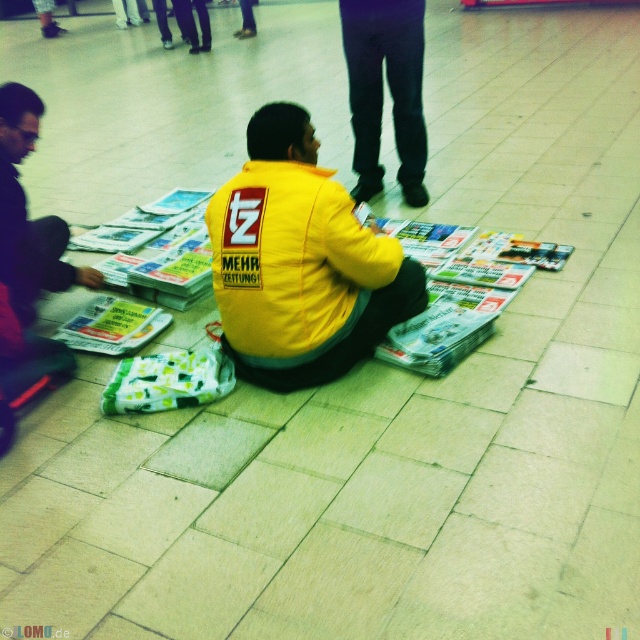
You are standing in the train station and see two points marked in the scene. Which point is closer to you, point (372, 131) or point (65, 333)?

Point (372, 131) is closer to you because it is further to the camera than point (65, 333).

You are a customer looking to buy a newspaper from the vendor in the scene. Where should you approach the yellow matte jacket at center to interact with them?

The yellow matte jacket at center is located at coordinates point (x=300, y=262), so you should approach that position to interact with the vendor.

You are a photographer trying to capture the scene of the newspaper vendor. You notice the dark blue jeans at center and the green glossy magazine at center. Which object is narrower in width?

The dark blue jeans at center has a lesser width compared to the green glossy magazine at center, so the dark blue jeans at center is narrower in width.